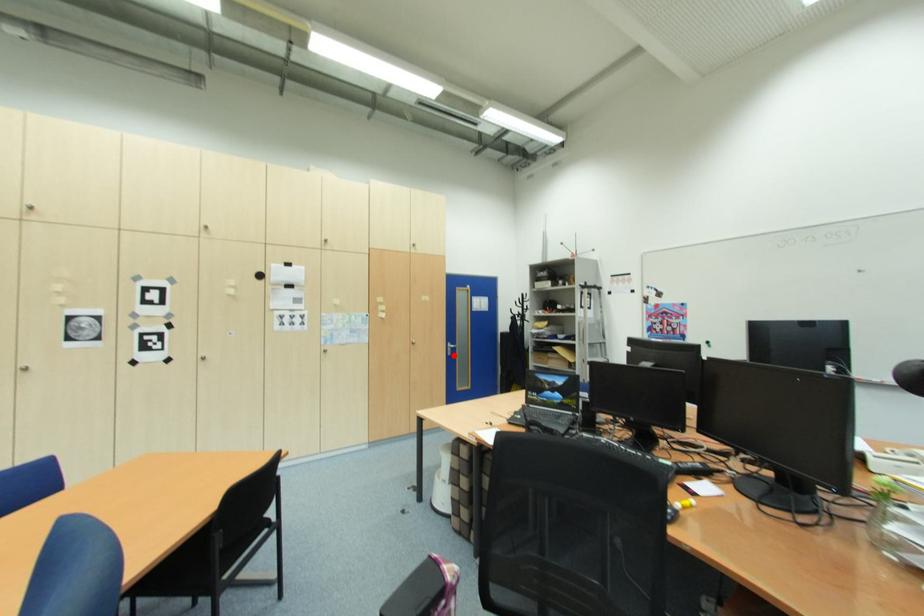
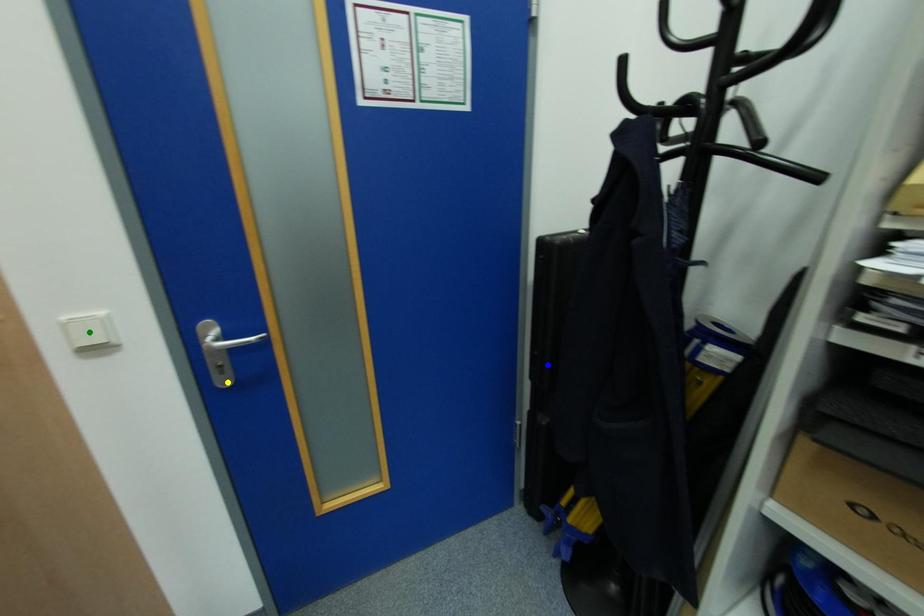
Question: I am providing you with two images of the same scene from different viewpoints. A red point is marked on the first image. You are given multiple points on the second image. Which point in image 2 is actually the same real-world point as the red point in image 1?

Choices:
 (A) green point
 (B) yellow point
 (C) blue point

Answer: (B)